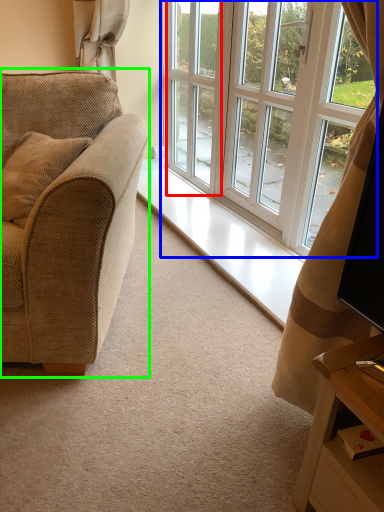
Question: Which object is the farthest from screen door (highlighted by a red box)? Choose among these: window (highlighted by a blue box) or studio couch (highlighted by a green box).

Choices:
 (A) window
 (B) studio couch

Answer: (B)